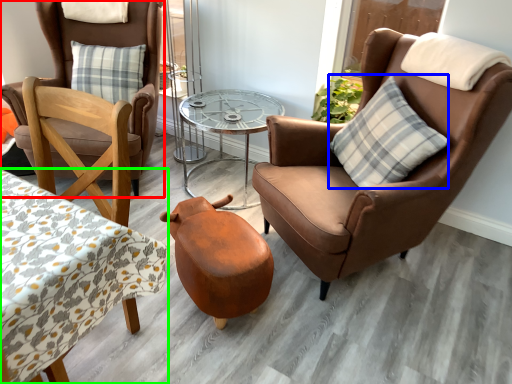
Question: Which object is positioned closest to chair (highlighted by a red box)? Select from pillow (highlighted by a blue box) and coffee table (highlighted by a green box).

Choices:
 (A) pillow
 (B) coffee table

Answer: (B)